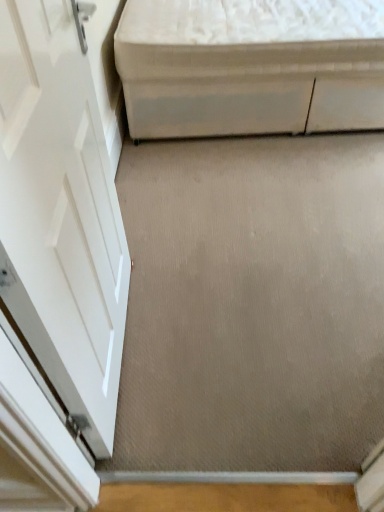
Question: Is beige carpet at center closer to the viewer compared to white fabric ottoman at upper right?

Choices:
 (A) no
 (B) yes

Answer: (B)

Question: Considering the relative sizes of beige carpet at center and white fabric ottoman at upper right in the image provided, is beige carpet at center smaller than white fabric ottoman at upper right?

Choices:
 (A) no
 (B) yes

Answer: (B)

Question: From the image's perspective, does beige carpet at center appear higher than white fabric ottoman at upper right?

Choices:
 (A) no
 (B) yes

Answer: (A)

Question: From a real-world perspective, is beige carpet at center located higher than white fabric ottoman at upper right?

Choices:
 (A) yes
 (B) no

Answer: (B)

Question: Is white fabric ottoman at upper right inside beige carpet at center?

Choices:
 (A) yes
 (B) no

Answer: (B)

Question: Is beige carpet at center thinner than white fabric ottoman at upper right?

Choices:
 (A) yes
 (B) no

Answer: (A)

Question: Does white fabric ottoman at upper right have a greater height compared to beige carpet at center?

Choices:
 (A) no
 (B) yes

Answer: (B)

Question: Is white fabric ottoman at upper right facing away from beige carpet at center?

Choices:
 (A) no
 (B) yes

Answer: (A)

Question: From the image's perspective, does white fabric ottoman at upper right appear higher than beige carpet at center?

Choices:
 (A) no
 (B) yes

Answer: (B)

Question: Would you say beige carpet at center is part of white fabric ottoman at upper right's contents?

Choices:
 (A) no
 (B) yes

Answer: (A)

Question: Are white fabric ottoman at upper right and beige carpet at center making contact?

Choices:
 (A) yes
 (B) no

Answer: (B)

Question: Is white fabric ottoman at upper right bigger than beige carpet at center?

Choices:
 (A) no
 (B) yes

Answer: (B)

Question: Considering the positions of beige carpet at center and white fabric ottoman at upper right in the image, is beige carpet at center taller or shorter than white fabric ottoman at upper right?

Choices:
 (A) tall
 (B) short

Answer: (B)